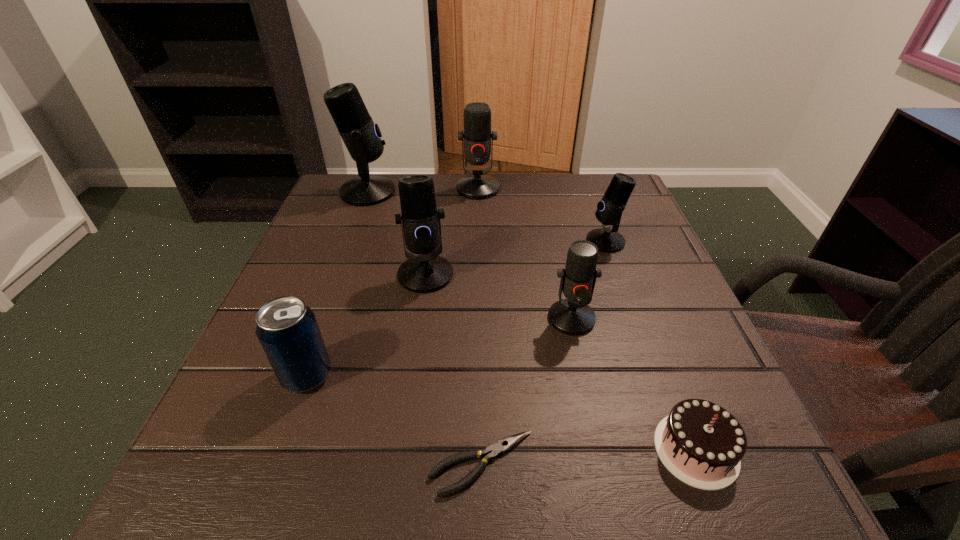
Where is `object situated at the near right corner`? object situated at the near right corner is located at coordinates (702, 444).

Where is `free spot at the far edge of the desktop`? free spot at the far edge of the desktop is located at coordinates (451, 206).

In the image, there is a desktop. Identify the location of vacant space at the near edge. (x=537, y=488).

Identify the location of vacant space at the left edge of the desktop. (221, 441).

Where is `blank space at the right edge of the desktop`? Image resolution: width=960 pixels, height=540 pixels. blank space at the right edge of the desktop is located at coordinates (705, 364).

Locate an element on the screen. vacant space at the far left corner is located at coordinates (339, 208).

Locate an element on the screen. Image resolution: width=960 pixels, height=540 pixels. free space at the near right corner of the desktop is located at coordinates (745, 472).

This screenshot has height=540, width=960. I want to click on free space between the bigger red microphone and the second nearest microphone, so click(x=452, y=232).

The height and width of the screenshot is (540, 960). Identify the location of empty space between the shortest object and the third nearest object. (395, 419).

You are a GUI agent. You are given a task and a screenshot of the screen. Output one action in this format:
    pyautogui.click(x=<x>, y=<y>)
    Task: Click on the vacant area that lies between the farther red microphone and the pliers
    The height and width of the screenshot is (540, 960).
    Given the screenshot: What is the action you would take?
    click(480, 326)